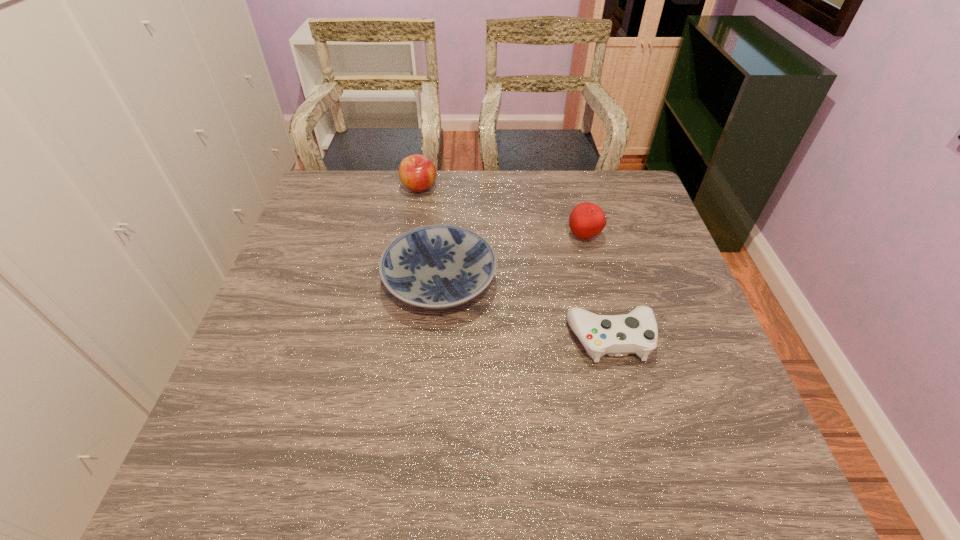
The image size is (960, 540). Identify the location of vacant region between the nearer apple and the control. (597, 287).

This screenshot has width=960, height=540. What are the coordinates of `free space between the farthest object and the control` in the screenshot? It's located at (515, 263).

Identify the location of vacant area that lies between the control and the left apple. (515, 263).

Where is `free space between the farthest object and the control`? free space between the farthest object and the control is located at coordinates (515, 263).

You are a GUI agent. You are given a task and a screenshot of the screen. Output one action in this format:
    pyautogui.click(x=<x>, y=<y>)
    Task: Click on the free point between the right apple and the farther apple
    This screenshot has width=960, height=540.
    Given the screenshot: What is the action you would take?
    (x=502, y=212)

Where is `free spot between the control and the plate`? This screenshot has height=540, width=960. free spot between the control and the plate is located at coordinates (525, 310).

At what (x,y) coordinates should I click in order to perform the action: click on empty space that is in between the nearer apple and the plate. Please return your answer as a coordinate pair (x, y). The width and height of the screenshot is (960, 540). Looking at the image, I should click on (512, 259).

Point out which object is positioned as the third nearest to the nearer apple. Please provide its 2D coordinates. Your answer should be formatted as a tuple, i.e. [(x, y)], where the tuple contains the x and y coordinates of a point satisfying the conditions above.

[(417, 173)]

Find the location of `object that ranks as the second closest to the control`. object that ranks as the second closest to the control is located at coordinates (587, 220).

At what (x,y) coordinates should I click in order to perform the action: click on vacant point that satisfies the following two spatial constraints: 1. on the front side of the left apple; 2. on the left side of the right apple. Please return your answer as a coordinate pair (x, y). This screenshot has height=540, width=960. Looking at the image, I should click on (411, 237).